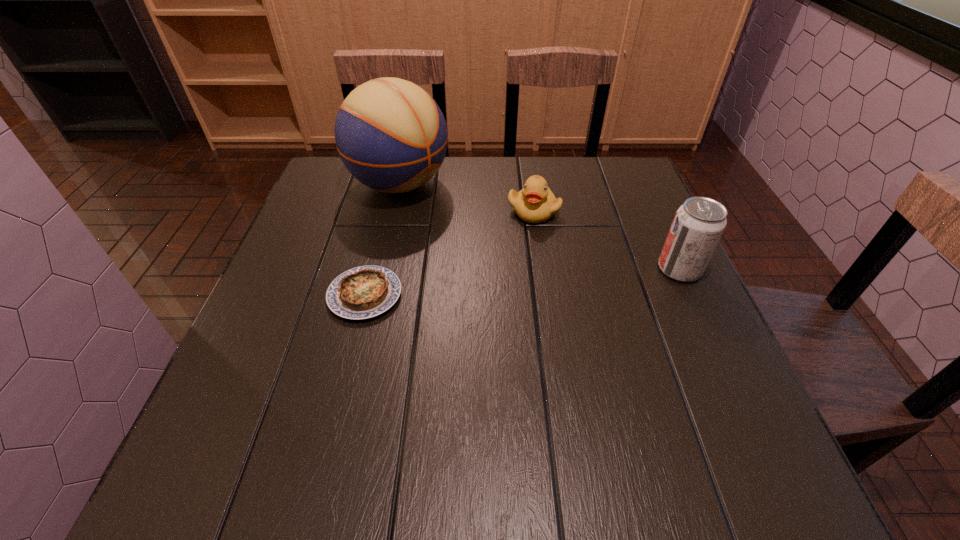
The height and width of the screenshot is (540, 960). In order to click on free space on the desktop that is between the shortest object and the soda can and is positioned on the patterned surface of the tallest object in this screenshot , I will do `click(557, 279)`.

At what (x,y) coordinates should I click in order to perform the action: click on free spot on the desktop that is between the shortest object and the third shortest object and is positioned on the beak of the duckling. Please return your answer as a coordinate pair (x, y). The width and height of the screenshot is (960, 540). Looking at the image, I should click on (567, 279).